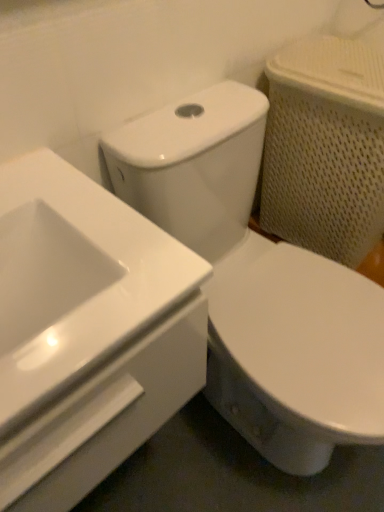
Find the location of a particular element. This screenshot has width=384, height=512. white glossy sink at upper left is located at coordinates (86, 332).

What do you see at coordinates (86, 332) in the screenshot?
I see `white glossy sink at upper left` at bounding box center [86, 332].

Locate an element on the screen. The height and width of the screenshot is (512, 384). white glossy toilet at center is located at coordinates (258, 284).

Describe the element at coordinates (258, 284) in the screenshot. I see `white glossy toilet at center` at that location.

Where is `white glossy sink at upper left`? The width and height of the screenshot is (384, 512). white glossy sink at upper left is located at coordinates (86, 332).

Considering the relative positions of white glossy sink at upper left and white glossy toilet at center in the image provided, is white glossy sink at upper left to the left of white glossy toilet at center from the viewer's perspective?

Indeed, white glossy sink at upper left is positioned on the left side of white glossy toilet at center.

In the image, is white glossy sink at upper left positioned in front of or behind white glossy toilet at center?

In the image, white glossy sink at upper left appears in front of white glossy toilet at center.

Is point (110, 269) positioned before point (242, 301)?

Yes, point (110, 269) is in front of point (242, 301).

From the image's perspective, which one is positioned higher, white glossy sink at upper left or white glossy toilet at center?

white glossy sink at upper left is shown above in the image.

From a real-world perspective, is white glossy sink at upper left beneath white glossy toilet at center?

No, from a real-world perspective, white glossy sink at upper left is not beneath white glossy toilet at center.

Is white glossy sink at upper left thinner than white glossy toilet at center?

Correct, the width of white glossy sink at upper left is less than that of white glossy toilet at center.

Can you confirm if white glossy sink at upper left is taller than white glossy toilet at center?

No.

Between white glossy sink at upper left and white glossy toilet at center, which one has larger size?

white glossy toilet at center.

Is white glossy sink at upper left outside of white glossy toilet at center?

Yes, white glossy sink at upper left is located beyond the bounds of white glossy toilet at center.

Is white glossy sink at upper left touching white glossy toilet at center?

No, white glossy sink at upper left is not in contact with white glossy toilet at center.

Is white glossy sink at upper left facing towards white glossy toilet at center?

No, white glossy sink at upper left is not facing towards white glossy toilet at center.

How different are the orientations of white glossy sink at upper left and white glossy toilet at center in degrees?

The angular difference between white glossy sink at upper left and white glossy toilet at center is 2.24 degrees.

You are a GUI agent. You are given a task and a screenshot of the screen. Output one action in this format:
    pyautogui.click(x=<x>, y=<y>)
    Task: Click on the toilet lying below the white glossy sink at upper left (from the image's perspective)
    This screenshot has height=512, width=384.
    Given the screenshot: What is the action you would take?
    pyautogui.click(x=258, y=284)

Based on their positions, is white glossy toilet at center located to the left or right of white glossy sink at upper left?

From the image, it's evident that white glossy toilet at center is to the right of white glossy sink at upper left.

Is the position of white glossy toilet at center less distant than that of white glossy sink at upper left?

No, white glossy toilet at center is further to the viewer.

Does point (233, 386) come closer to viewer compared to point (101, 214)?

No, (233, 386) is behind (101, 214).

Looking at this image, from the image's perspective, relative to white glossy sink at upper left, is white glossy toilet at center above or below?

white glossy toilet at center is below white glossy sink at upper left.

From a real-world perspective, is white glossy toilet at center above or below white glossy sink at upper left?

Clearly, from a real-world perspective, white glossy toilet at center is below white glossy sink at upper left.

Between white glossy toilet at center and white glossy sink at upper left, which one has smaller width?

With smaller width is white glossy sink at upper left.

Who is shorter, white glossy toilet at center or white glossy sink at upper left?

white glossy sink at upper left is shorter.

Between white glossy toilet at center and white glossy sink at upper left, which one has smaller size?

With smaller size is white glossy sink at upper left.

Is white glossy toilet at center positioned beyond the bounds of white glossy sink at upper left?

Yes.

Is white glossy toilet at center far away from white glossy sink at upper left?

No, white glossy toilet at center is not far from white glossy sink at upper left.

Is white glossy toilet at center turned away from white glossy sink at upper left?

white glossy toilet at center is not turned away from white glossy sink at upper left.

How different are the orientations of white glossy toilet at center and white glossy sink at upper left in degrees?

The angle between the facing direction of white glossy toilet at center and the facing direction of white glossy sink at upper left is 2.24 degrees.

Where is `sink on the left of white glossy toilet at center`? The image size is (384, 512). sink on the left of white glossy toilet at center is located at coordinates (86, 332).

Find the location of a particular element. sink located on the left of white glossy toilet at center is located at coordinates (86, 332).

Image resolution: width=384 pixels, height=512 pixels. In the image, there is a white glossy sink at upper left. What are the coordinates of `toilet below it (from the image's perspective)` in the screenshot? It's located at (258, 284).